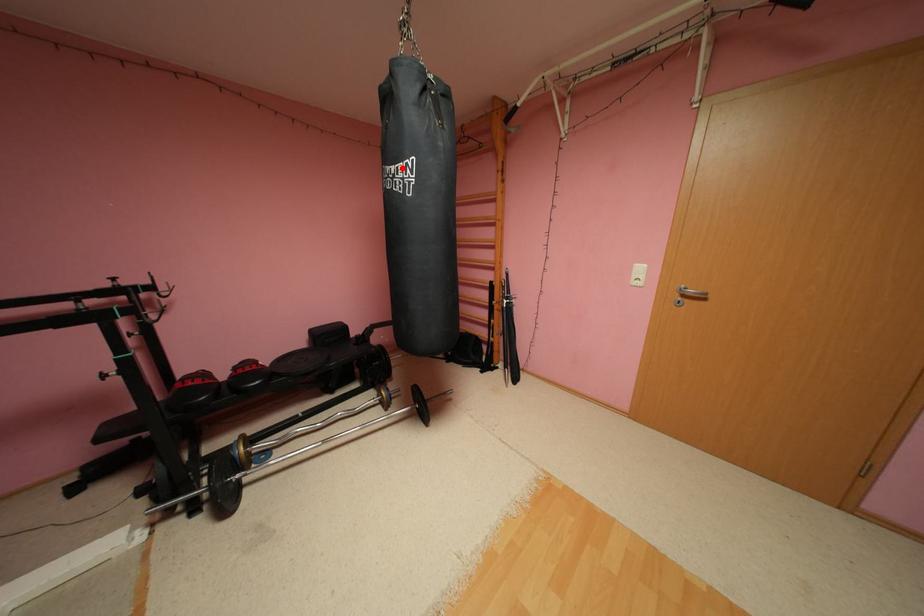
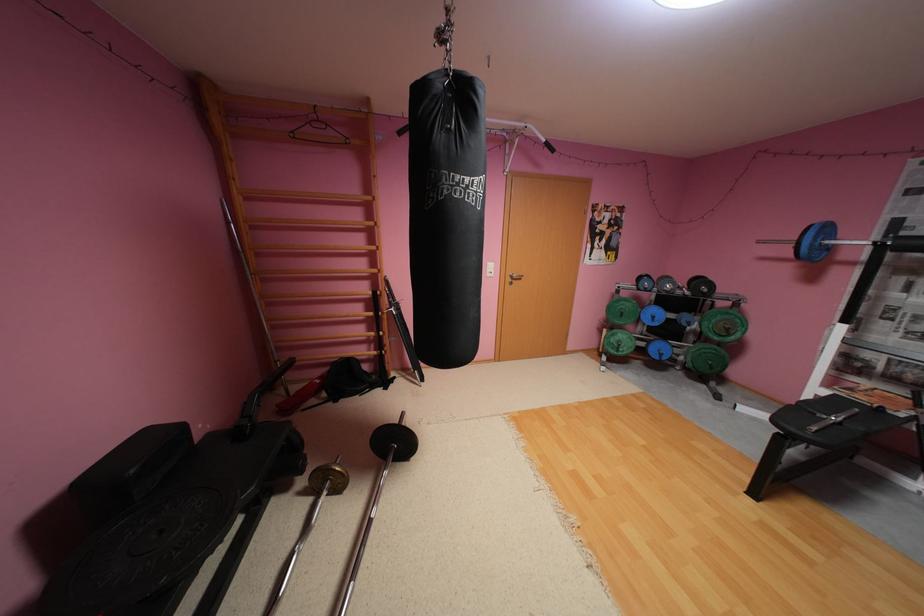
Find the pixel in the second image that matches the highlighted location in the first image.

(477, 179)